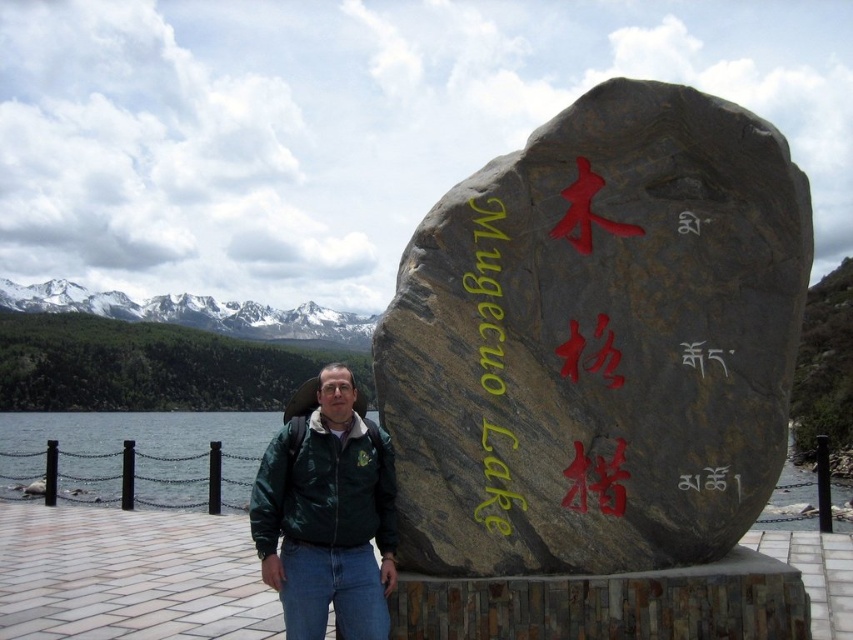
Question: Is green matte jacket at center to the left of yellow painted text at center from the viewer's perspective?

Choices:
 (A) yes
 (B) no

Answer: (A)

Question: Among these objects, which one is farthest from the camera?

Choices:
 (A) yellow painted text at center
 (B) brown stone sign at center
 (C) clear water at lake right
 (D) clear water at dock left

Answer: (D)

Question: Does brown stone sign at center have a lesser width compared to green matte jacket at center?

Choices:
 (A) yes
 (B) no

Answer: (B)

Question: Can you confirm if green matte jacket at center is thinner than yellow painted text at center?

Choices:
 (A) no
 (B) yes

Answer: (A)

Question: Which point is closer to the camera?

Choices:
 (A) green matte jacket at center
 (B) clear water at dock left

Answer: (A)

Question: Estimate the real-world distances between objects in this image. Which object is farther from the brown stone sign at center?

Choices:
 (A) clear water at dock left
 (B) yellow painted text at center

Answer: (A)